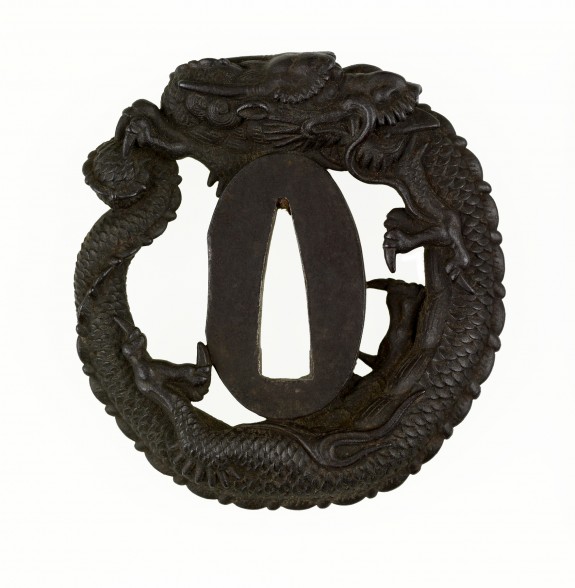
This screenshot has width=575, height=588. Find the location of `artwork`. artwork is located at coordinates (398, 400).